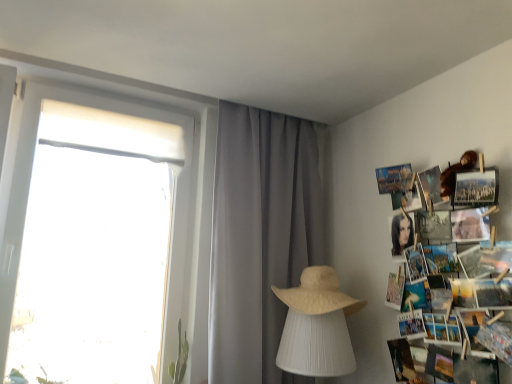
Measure the distance between printed paper collage at right and camera.

The distance of printed paper collage at right from camera is 4.46 feet.

In the scene shown: What is the approximate width of printed paper collage at right?

printed paper collage at right is 12.30 centimeters wide.

What is the approximate height of beige straw hat at center?

22.32 centimeters.

Locate an element on the screen. The height and width of the screenshot is (384, 512). gray sheer curtain at center is located at coordinates (260, 238).

Is printed paper collage at right wider or thinner than beige straw hat at center?

In the image, printed paper collage at right appears to be more narrow than beige straw hat at center.

You are a GUI agent. You are given a task and a screenshot of the screen. Output one action in this format:
    pyautogui.click(x=<x>, y=<y>)
    Task: Click on the straw hat that is behind the printed paper collage at right
    This screenshot has width=512, height=384.
    Given the screenshot: What is the action you would take?
    pyautogui.click(x=318, y=294)

Would you say printed paper collage at right is to the left or to the right of beige straw hat at center in the picture?

Based on their positions, printed paper collage at right is located to the right of beige straw hat at center.

From the image's perspective, is printed paper collage at right located above or below gray sheer curtain at center?

Based on their image positions, printed paper collage at right is located beneath gray sheer curtain at center.

Which is more to the left, printed paper collage at right or gray sheer curtain at center?

Positioned to the left is gray sheer curtain at center.

Measure the distance between printed paper collage at right and gray sheer curtain at center.

A distance of 26.85 inches exists between printed paper collage at right and gray sheer curtain at center.

Is printed paper collage at right positioned with its back to gray sheer curtain at center?

No, gray sheer curtain at center is not at the back of printed paper collage at right.

Looking at this image, which object is more forward, gray sheer curtain at center or beige straw hat at center?

beige straw hat at center is in front.

Is gray sheer curtain at center next to beige straw hat at center?

gray sheer curtain at center and beige straw hat at center are clearly separated.

Is gray sheer curtain at center oriented towards beige straw hat at center?

Yes, gray sheer curtain at center is turned towards beige straw hat at center.

In terms of height, does gray sheer curtain at center look taller or shorter compared to beige straw hat at center?

Clearly, gray sheer curtain at center is taller compared to beige straw hat at center.

Does point (234, 293) come closer to viewer compared to point (392, 307)?

No, it is behind (392, 307).

How different are the orientations of gray sheer curtain at center and printed paper collage at right in degrees?

The angular difference between gray sheer curtain at center and printed paper collage at right is 90.5 degrees.

From a real-world perspective, relative to printed paper collage at right, is gray sheer curtain at center vertically above or below?

Clearly, from a real-world perspective, gray sheer curtain at center is above printed paper collage at right.

Based on the photo, could you tell me if gray sheer curtain at center is turned towards printed paper collage at right?

Yes, gray sheer curtain at center is aimed at printed paper collage at right.

Which object is further away from the camera, beige straw hat at center or gray sheer curtain at center?

gray sheer curtain at center is more distant.

Are beige straw hat at center and gray sheer curtain at center making contact?

No, beige straw hat at center is not next to gray sheer curtain at center.

Choose the correct answer: Is beige straw hat at center inside gray sheer curtain at center or outside it?

beige straw hat at center is spatially situated outside gray sheer curtain at center.

Based on the photo, from a real-world perspective, is beige straw hat at center above or below gray sheer curtain at center?

From a real-world perspective, beige straw hat at center is physically below gray sheer curtain at center.

Is beige straw hat at center bigger than printed paper collage at right?

No, beige straw hat at center is not bigger than printed paper collage at right.

How many degrees apart are the facing directions of beige straw hat at center and printed paper collage at right?

beige straw hat at center and printed paper collage at right are facing 4.29 degrees away from each other.

Is beige straw hat at center beside printed paper collage at right?

They are not placed beside each other.

Where is `straw hat that is behind the printed paper collage at right`? Image resolution: width=512 pixels, height=384 pixels. straw hat that is behind the printed paper collage at right is located at coordinates (318, 294).

This screenshot has height=384, width=512. Find the location of `curtain to the left of printed paper collage at right`. curtain to the left of printed paper collage at right is located at coordinates (260, 238).

Based on their spatial positions, is gray sheer curtain at center or beige straw hat at center further from printed paper collage at right?

gray sheer curtain at center is positioned further to the anchor printed paper collage at right.

Estimate the real-world distances between objects in this image. Which object is closer to gray sheer curtain at center, printed paper collage at right or beige straw hat at center?

beige straw hat at center.

In the scene shown: Based on their spatial positions, is printed paper collage at right or gray sheer curtain at center further from beige straw hat at center?

The object further to beige straw hat at center is printed paper collage at right.

Which object lies further to the anchor point beige straw hat at center, gray sheer curtain at center or printed paper collage at right?

The object further to beige straw hat at center is printed paper collage at right.

Estimate the real-world distances between objects in this image. Which object is closer to gray sheer curtain at center, beige straw hat at center or printed paper collage at right?

The object closer to gray sheer curtain at center is beige straw hat at center.

Considering their positions, is beige straw hat at center positioned closer to printed paper collage at right than gray sheer curtain at center?

Based on the image, beige straw hat at center appears to be nearer to printed paper collage at right.

Locate an element on the screen. The width and height of the screenshot is (512, 384). straw hat situated between gray sheer curtain at center and printed paper collage at right from left to right is located at coordinates (318, 294).